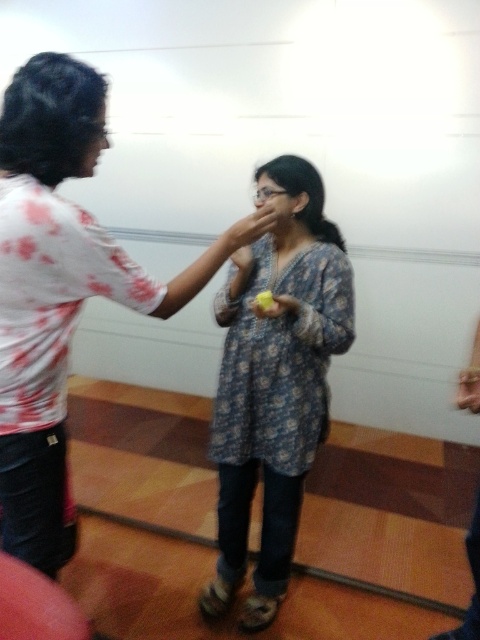
Does floral-patterned dress at center appear on the left side of yellow matte apple at center?

Yes, floral-patterned dress at center is to the left of yellow matte apple at center.

What do you see at coordinates (54, 289) in the screenshot?
I see `floral-patterned dress at center` at bounding box center [54, 289].

Is point (9, 397) positioned in front of point (275, 307)?

Yes, point (9, 397) is in front of point (275, 307).

Where is `floral-patterned dress at center`? The image size is (480, 640). floral-patterned dress at center is located at coordinates (54, 289).

Between floral-patterned dress at center and matte skin hand at center, which one has less height?

matte skin hand at center

Can you confirm if floral-patterned dress at center is thinner than matte skin hand at center?

In fact, floral-patterned dress at center might be wider than matte skin hand at center.

Image resolution: width=480 pixels, height=640 pixels. What do you see at coordinates (54, 289) in the screenshot?
I see `floral-patterned dress at center` at bounding box center [54, 289].

Where is `floral-patterned dress at center`? This screenshot has width=480, height=640. floral-patterned dress at center is located at coordinates (54, 289).

Between floral-patterned fabric dress at center and yellow matte apple at center, which one appears on the left side from the viewer's perspective?

From the viewer's perspective, yellow matte apple at center appears more on the left side.

Does floral-patterned fabric dress at center appear on the left side of yellow matte apple at center?

In fact, floral-patterned fabric dress at center is to the right of yellow matte apple at center.

Which is behind, point (240, 285) or point (278, 296)?

Positioned behind is point (240, 285).

The image size is (480, 640). Identify the location of floral-patterned fabric dress at center. (275, 384).